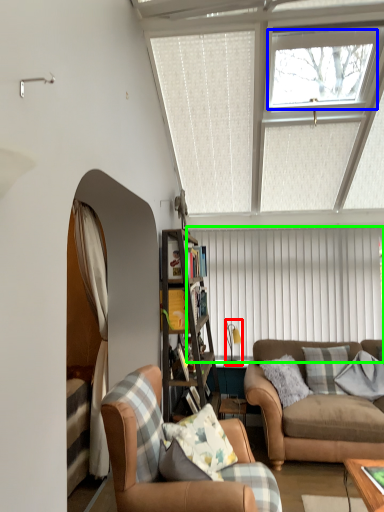
Question: Which is nearer to the lamp (highlighted by a red box)? window (highlighted by a blue box) or blind (highlighted by a green box).

Choices:
 (A) window
 (B) blind

Answer: (B)